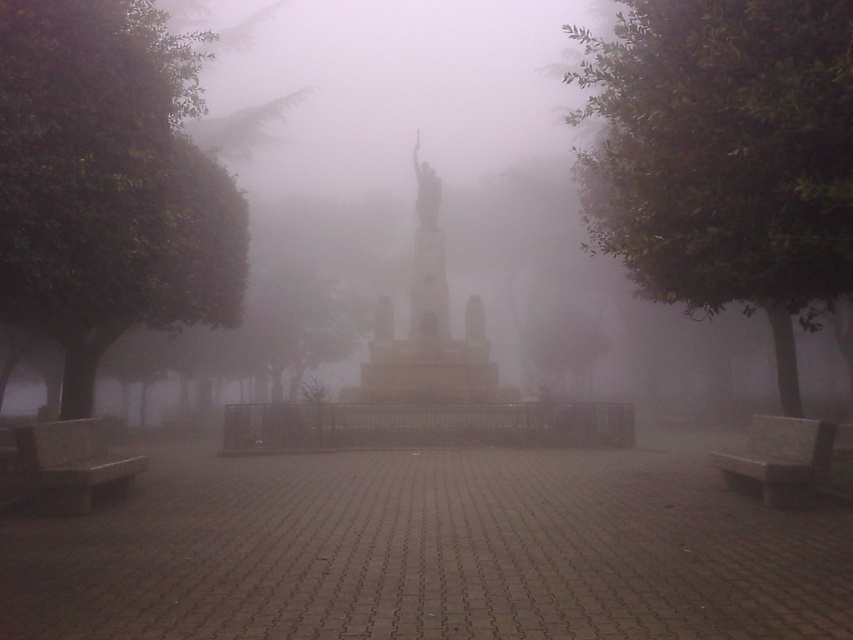
Between smooth gray bench at lower left and gray stone bench at lower right, which one appears on the left side from the viewer's perspective?

Positioned to the left is smooth gray bench at lower left.

Can you confirm if smooth gray bench at lower left is bigger than gray stone bench at lower right?

Yes, smooth gray bench at lower left is bigger than gray stone bench at lower right.

Who is more forward, (59, 460) or (772, 452)?

Point (59, 460) is in front.

In order to click on smooth gray bench at lower left in this screenshot , I will do `click(71, 464)`.

Is green leafy tree at right to the left of gray stone bench at lower right from the viewer's perspective?

Incorrect, green leafy tree at right is not on the left side of gray stone bench at lower right.

Does point (715, 282) lie behind point (784, 497)?

No.

Where is `green leafy tree at right`? The image size is (853, 640). green leafy tree at right is located at coordinates (723, 156).

Between green leafy tree at left and stone statue at center, which one appears on the right side from the viewer's perspective?

stone statue at center is more to the right.

In the scene shown: Can you confirm if green leafy tree at left is shorter than stone statue at center?

In fact, green leafy tree at left may be taller than stone statue at center.

Where is `green leafy tree at left`? green leafy tree at left is located at coordinates (108, 182).